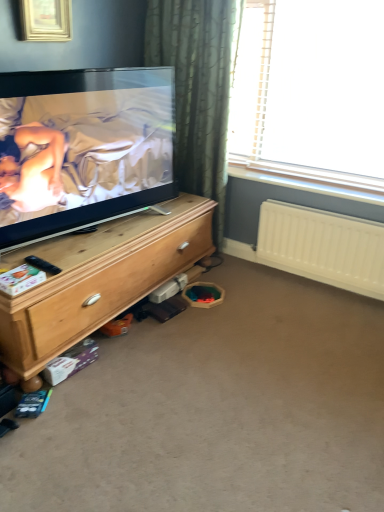
Question: Is wooden chest of drawers at left looking in the opposite direction of transparent plastic window at upper right?

Choices:
 (A) no
 (B) yes

Answer: (A)

Question: From a real-world perspective, is wooden chest of drawers at left beneath transparent plastic window at upper right?

Choices:
 (A) no
 (B) yes

Answer: (B)

Question: Considering the relative positions of wooden chest of drawers at left and transparent plastic window at upper right in the image provided, is wooden chest of drawers at left to the right of transparent plastic window at upper right from the viewer's perspective?

Choices:
 (A) yes
 (B) no

Answer: (B)

Question: Can you confirm if wooden chest of drawers at left is shorter than transparent plastic window at upper right?

Choices:
 (A) yes
 (B) no

Answer: (A)

Question: Does wooden chest of drawers at left have a smaller size compared to transparent plastic window at upper right?

Choices:
 (A) yes
 (B) no

Answer: (B)

Question: Does wooden chest of drawers at left contain transparent plastic window at upper right?

Choices:
 (A) no
 (B) yes

Answer: (A)

Question: From the image's perspective, is wooden chest of drawers at left on black plastic remote control at lower left?

Choices:
 (A) no
 (B) yes

Answer: (A)

Question: Is the position of wooden chest of drawers at left less distant than that of black plastic remote control at lower left?

Choices:
 (A) no
 (B) yes

Answer: (B)

Question: Does wooden chest of drawers at left have a lesser height compared to black plastic remote control at lower left?

Choices:
 (A) yes
 (B) no

Answer: (B)

Question: From a real-world perspective, is wooden chest of drawers at left physically below black plastic remote control at lower left?

Choices:
 (A) no
 (B) yes

Answer: (B)

Question: Can you confirm if wooden chest of drawers at left is smaller than black plastic remote control at lower left?

Choices:
 (A) yes
 (B) no

Answer: (B)

Question: Can you confirm if wooden chest of drawers at left is bigger than black plastic remote control at lower left?

Choices:
 (A) yes
 (B) no

Answer: (A)

Question: Is white plastic radiator at lower right oriented towards carpet at lower center?

Choices:
 (A) no
 (B) yes

Answer: (B)